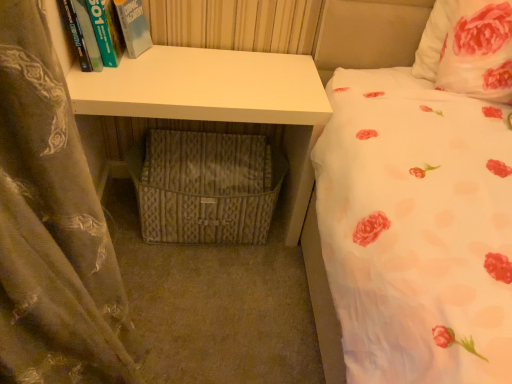
Question: Is white matte desk at center a part of white floral fabric pillow at upper right?

Choices:
 (A) no
 (B) yes

Answer: (A)

Question: Is white floral fabric pillow at upper right bigger than white matte desk at center?

Choices:
 (A) yes
 (B) no

Answer: (B)

Question: Does white floral fabric pillow at upper right appear on the left side of white matte desk at center?

Choices:
 (A) yes
 (B) no

Answer: (B)

Question: Does white floral fabric pillow at upper right turn towards white matte desk at center?

Choices:
 (A) no
 (B) yes

Answer: (A)

Question: Is white floral fabric pillow at upper right to the right of white matte desk at center from the viewer's perspective?

Choices:
 (A) yes
 (B) no

Answer: (A)

Question: Is white floral fabric pillow at upper right behind white matte desk at center?

Choices:
 (A) yes
 (B) no

Answer: (B)

Question: Is white floral fabric pillow at upper right outside hardcover book at upper left?

Choices:
 (A) yes
 (B) no

Answer: (A)

Question: From the image's perspective, would you say white floral fabric pillow at upper right is positioned over hardcover book at upper left?

Choices:
 (A) no
 (B) yes

Answer: (A)

Question: Is white floral fabric pillow at upper right positioned far away from hardcover book at upper left?

Choices:
 (A) no
 (B) yes

Answer: (B)

Question: From a real-world perspective, is white floral fabric pillow at upper right under hardcover book at upper left?

Choices:
 (A) no
 (B) yes

Answer: (A)

Question: From the image's perspective, does white floral fabric pillow at upper right appear lower than hardcover book at upper left?

Choices:
 (A) yes
 (B) no

Answer: (A)

Question: Is white floral fabric pillow at upper right in contact with hardcover book at upper left?

Choices:
 (A) yes
 (B) no

Answer: (B)

Question: Is white floral fabric pillow at upper right not within woven fabric crate at lower center?

Choices:
 (A) yes
 (B) no

Answer: (A)